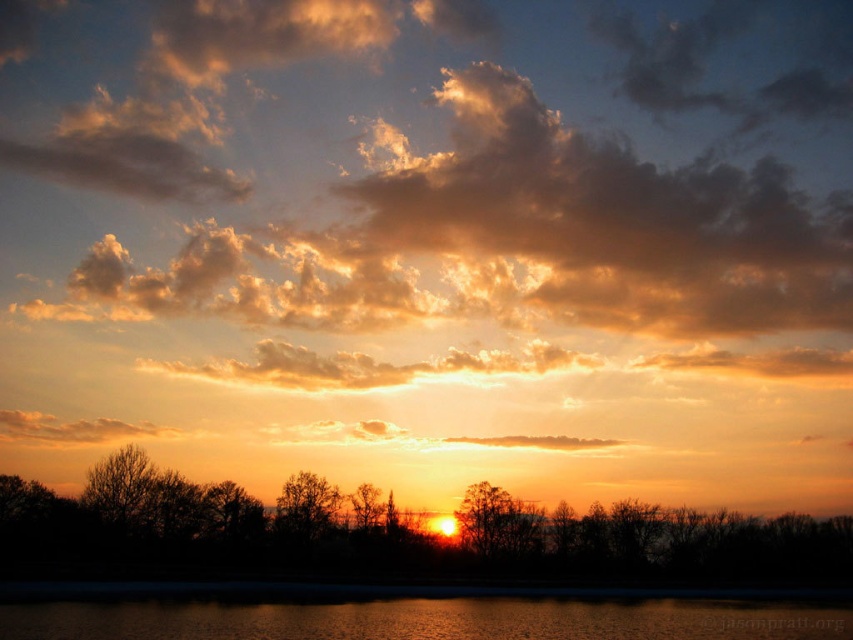
Who is taller, glistening water at lower center or brown textured tree at center?

With more height is glistening water at lower center.

Can you confirm if glistening water at lower center is taller than brown textured tree at center?

Yes, glistening water at lower center is taller than brown textured tree at center.

Does point (608, 618) come in front of point (312, 531)?

Yes, it is.

You are a GUI agent. You are given a task and a screenshot of the screen. Output one action in this format:
    pyautogui.click(x=<x>, y=<y>)
    Task: Click on the glistening water at lower center
    
    Given the screenshot: What is the action you would take?
    pyautogui.click(x=422, y=618)

This screenshot has height=640, width=853. What do you see at coordinates (393, 536) in the screenshot?
I see `silhouette tree at center` at bounding box center [393, 536].

Is silhouette tree at center thinner than brown matte tree at center?

Incorrect, silhouette tree at center's width is not less than brown matte tree at center's.

Is point (473, 528) in front of point (489, 504)?

That is True.

Find the location of a particular element. silhouette tree at center is located at coordinates (393, 536).

Identify the location of golden fluffy cloud at upper center. (610, 221).

Who is positioned more to the left, golden fluffy cloud at upper center or brown matte tree at center?

Positioned to the left is brown matte tree at center.

Locate an element on the screen. The height and width of the screenshot is (640, 853). golden fluffy cloud at upper center is located at coordinates (610, 221).